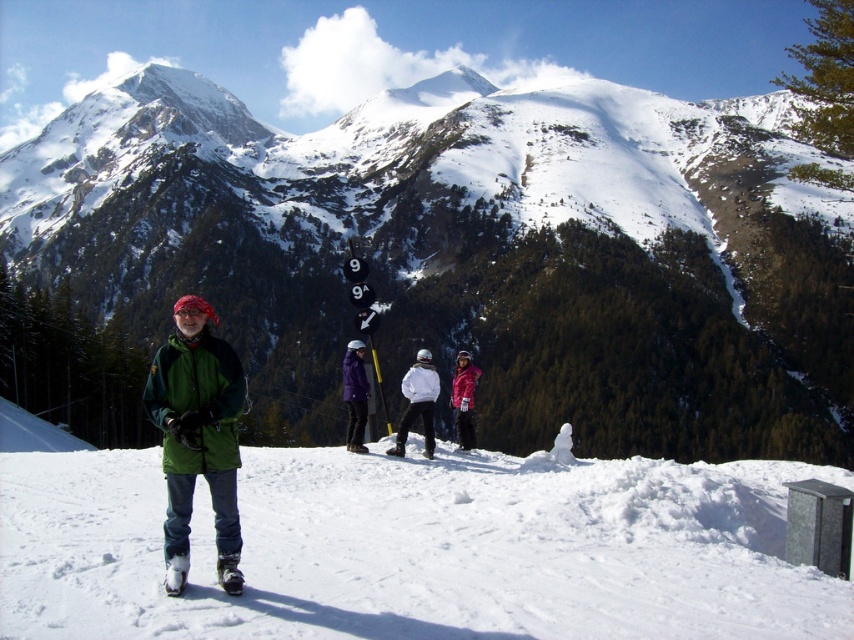
You are a photographer trying to capture both the green matte jacket at center and the white matte jacket at center in a single frame. Which jacket should you focus on first to ensure both are in the shot?

The green matte jacket at center is taller than the white matte jacket at center, so focusing on the green matte jacket at center first will help ensure both are captured in the frame.

You are planning to take a photo of the snowy mountain at center and the white matte jacket at center. Which object should you focus on first if you want to capture both in the same frame without moving the camera?

The snowy mountain at center is taller than the white matte jacket at center, so you should focus on the snowy mountain at center first to ensure it fits within the frame.

You are standing at the point with coordinates point (412,387) and want to move towards the point with coordinates point (191,484). Since you can only move forward, will you be moving towards or away from the camera?

Point (191,484) is closer to the camera than point (412,387). Therefore, moving towards point (191,484) means you are moving closer to the camera.